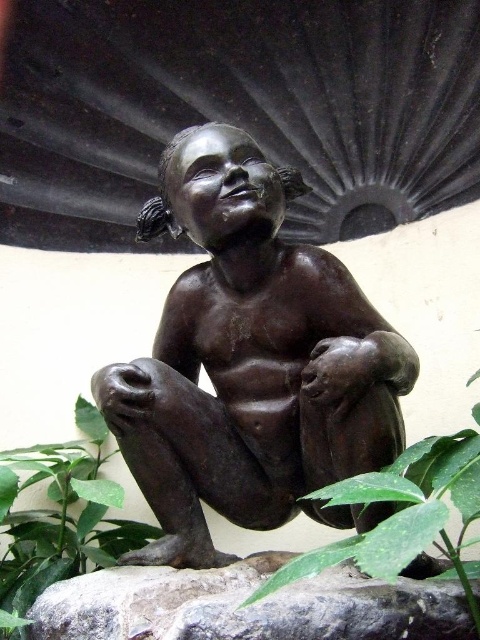
You are standing in front of the bronze statue at center and want to place a small decoration on the green leafy plant at lower center. Can you reach the plant without moving your position?

The bronze statue at center is further to the viewer than the green leafy plant at lower center, so you can reach the plant without moving your position because it is closer to you.

You are an artist who wants to create a miniature version of the bronze statue at center and the green leafy plant at lower center for a diorama. If the miniature must maintain the same size relationship between the two objects as in the original image, which object should you make larger?

The bronze statue at center should be made larger than the green leafy plant at lower center because the bronze statue at center is bigger than the green leafy plant at lower center in the original image.